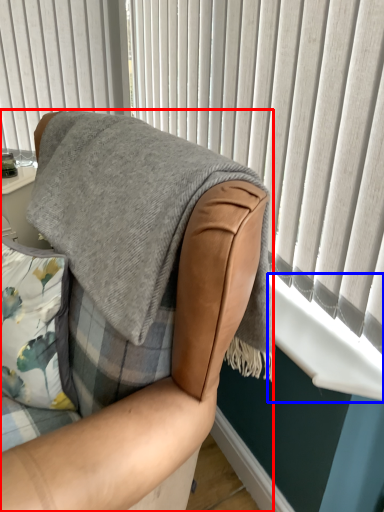
Question: Which object appears farthest to the camera in this image, chair (highlighted by a red box) or window sill (highlighted by a blue box)?

Choices:
 (A) chair
 (B) window sill

Answer: (B)